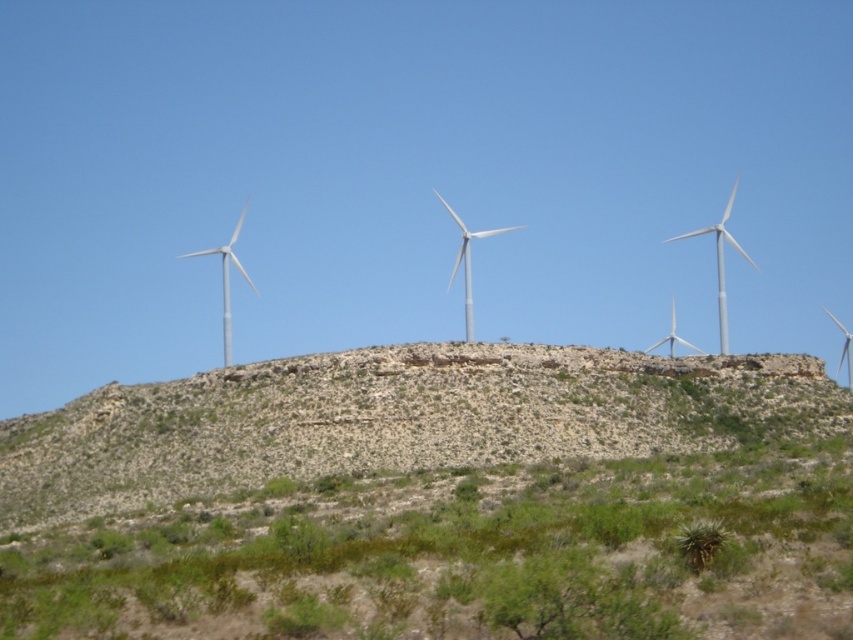
Who is positioned more to the left, green shrubbery at lower center or white metallic wind turbine at center?

From the viewer's perspective, green shrubbery at lower center appears more on the left side.

Can you confirm if green shrubbery at lower center is bigger than white metallic wind turbine at center?

Incorrect, green shrubbery at lower center is not larger than white metallic wind turbine at center.

Is point (751, 515) closer to camera compared to point (451, 211)?

Yes.

Where is `green shrubbery at lower center`? The image size is (853, 640). green shrubbery at lower center is located at coordinates (465, 556).

In the scene shown: Is white matte wind turbine at left wider than white matte wind turbine at center?

Correct, the width of white matte wind turbine at left exceeds that of white matte wind turbine at center.

Is point (229, 360) behind point (701, 353)?

No, it is in front of (701, 353).

You are a GUI agent. You are given a task and a screenshot of the screen. Output one action in this format:
    pyautogui.click(x=<x>, y=<y>)
    Task: Click on the white matte wind turbine at left
    Image resolution: width=853 pixels, height=640 pixels.
    Given the screenshot: What is the action you would take?
    pyautogui.click(x=227, y=282)

The width and height of the screenshot is (853, 640). In order to click on white matte wind turbine at left in this screenshot , I will do `click(227, 282)`.

Does white metallic wind turbine at upper right appear over white metallic wind turbine at center?

Correct, white metallic wind turbine at upper right is located above white metallic wind turbine at center.

Is white metallic wind turbine at upper right to the right of white metallic wind turbine at center from the viewer's perspective?

Yes, white metallic wind turbine at upper right is to the right of white metallic wind turbine at center.

What do you see at coordinates (720, 262) in the screenshot? Image resolution: width=853 pixels, height=640 pixels. I see `white metallic wind turbine at upper right` at bounding box center [720, 262].

Identify the location of white metallic wind turbine at upper right. This screenshot has height=640, width=853. (720, 262).